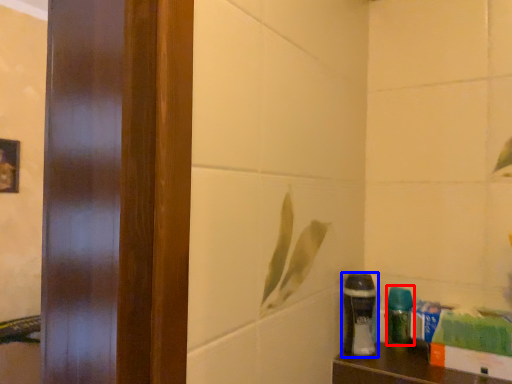
Question: Which point is further to the camera, cleaning product (highlighted by a red box) or shaving cream (highlighted by a blue box)?

Choices:
 (A) cleaning product
 (B) shaving cream

Answer: (A)